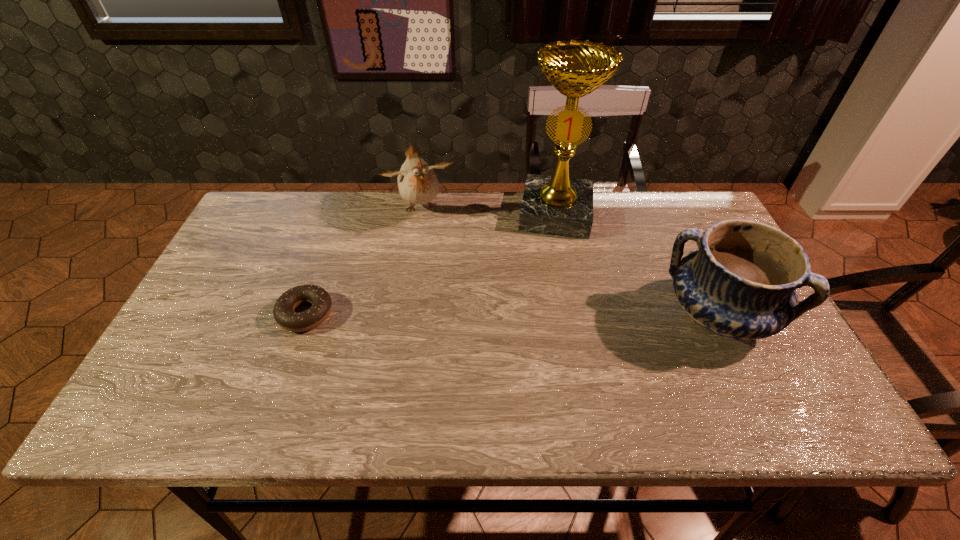
Find the location of a particular element. vacant region between the shortest object and the tallest object is located at coordinates (431, 264).

You are a GUI agent. You are given a task and a screenshot of the screen. Output one action in this format:
    pyautogui.click(x=<x>, y=<y>)
    Task: Click on the free space between the third object from right to left and the award
    This screenshot has height=540, width=960.
    Given the screenshot: What is the action you would take?
    pyautogui.click(x=488, y=211)

Locate an element on the screen. empty location between the second object from right to left and the pottery is located at coordinates (636, 265).

At what (x,y) coordinates should I click in order to perform the action: click on free space between the leftmost object and the bird. Please return your answer as a coordinate pair (x, y). The image size is (960, 540). Looking at the image, I should click on (363, 261).

Choose which object is the third nearest neighbor to the tallest object. Please provide its 2D coordinates. Your answer should be formatted as a tuple, i.e. [(x, y)], where the tuple contains the x and y coordinates of a point satisfying the conditions above.

[(283, 312)]

The image size is (960, 540). What are the coordinates of `the closest object to the shortest object` in the screenshot? It's located at (417, 182).

Locate an element on the screen. free space that satisfies the following two spatial constraints: 1. on the front side of the shortest object; 2. on the left side of the pottery is located at coordinates click(305, 315).

In order to click on vacant space that satisfies the following two spatial constraints: 1. on the front side of the shortest object; 2. on the left side of the pottery in this screenshot , I will do `click(305, 315)`.